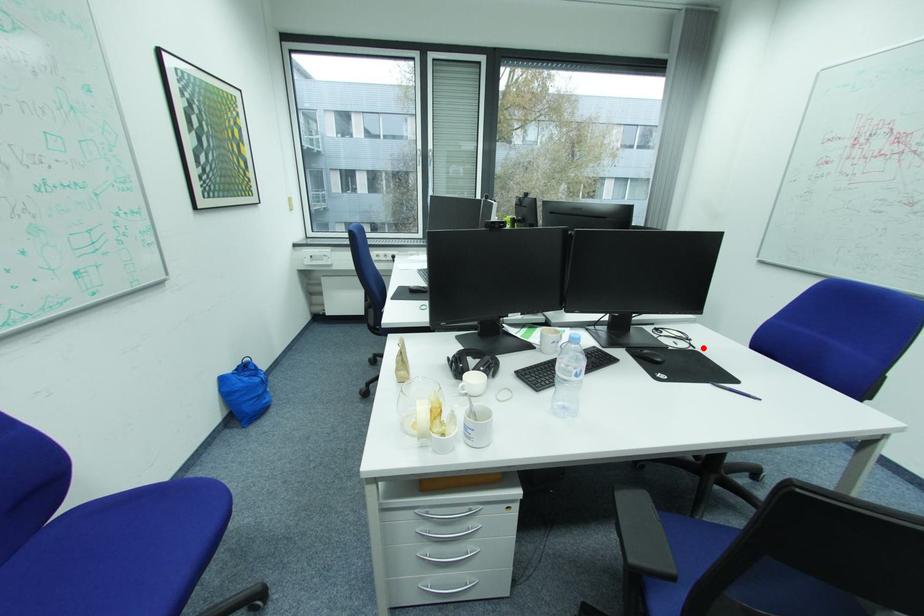
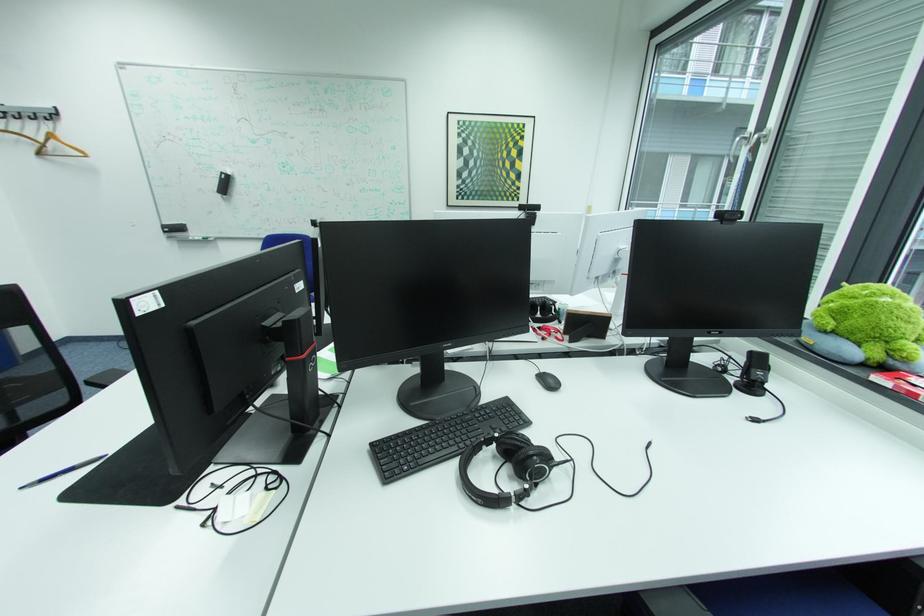
Locate, in the second image, the point that corresponds to the highlighted location in the first image.

(187, 508)